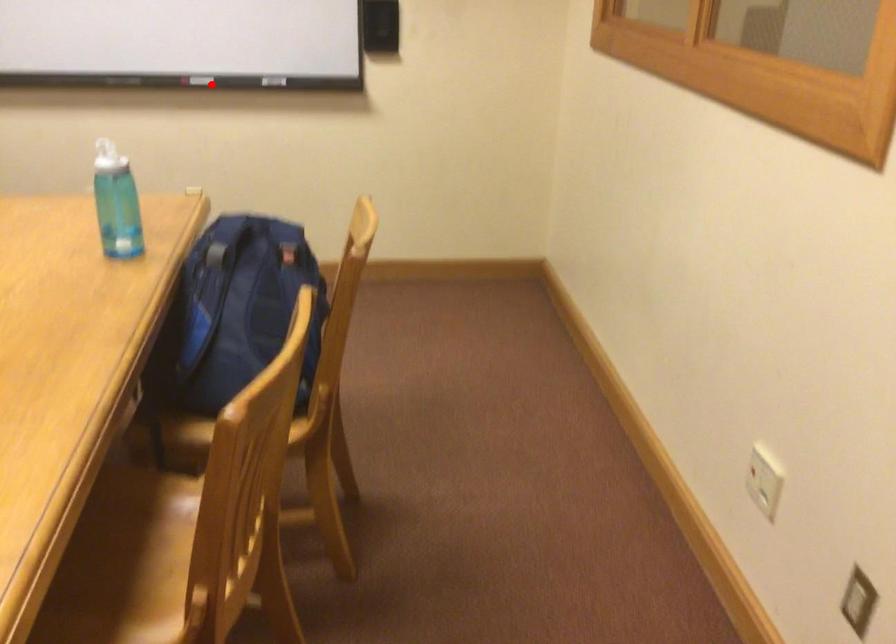
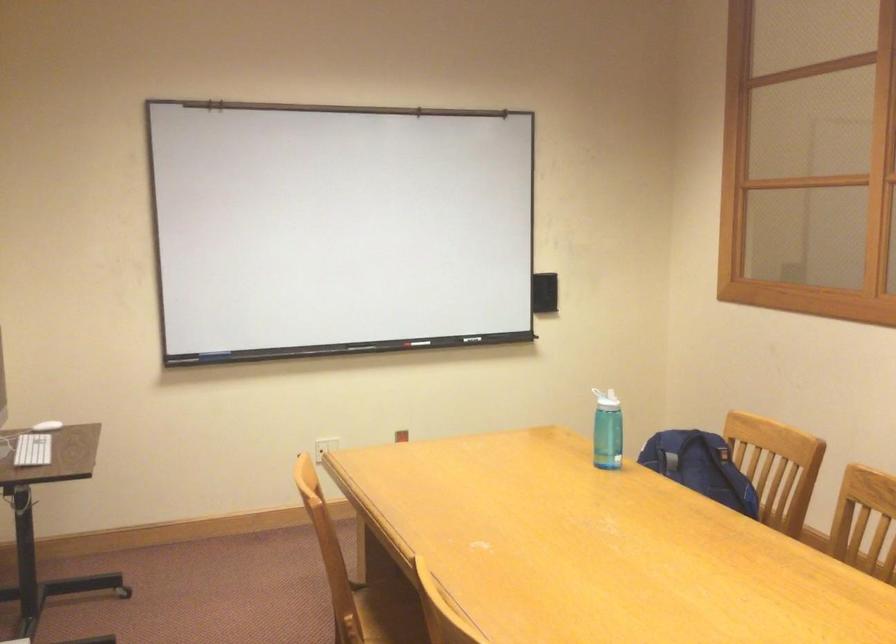
Where in the second image is the point corresponding to the highlighted location from the first image?

(420, 343)